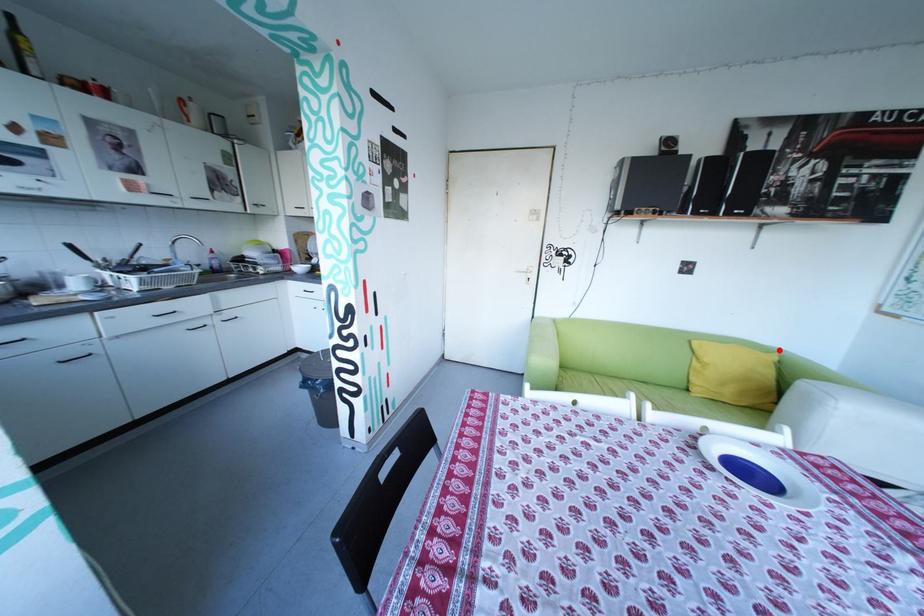
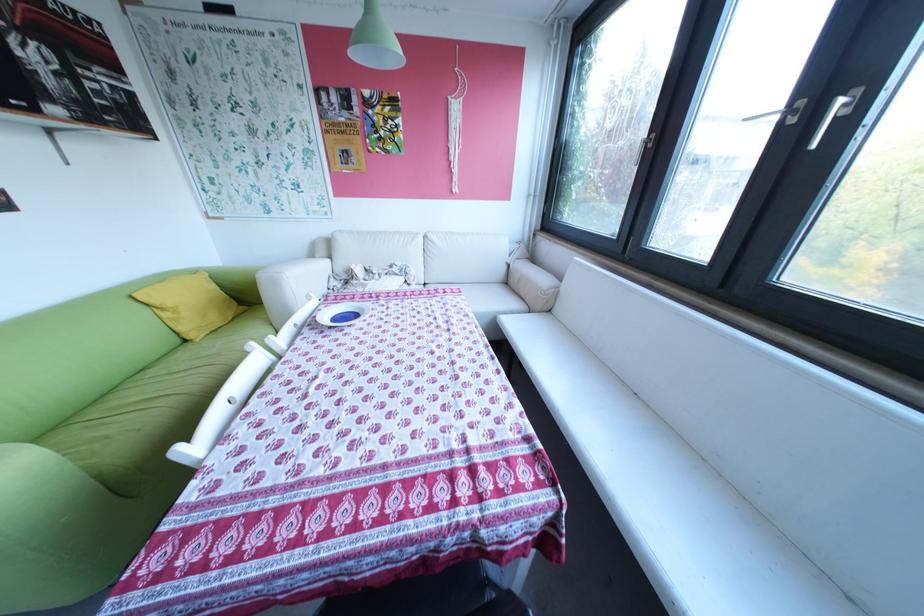
Where in the second image is the point corresponding to the highlighted location from the first image?

(207, 270)